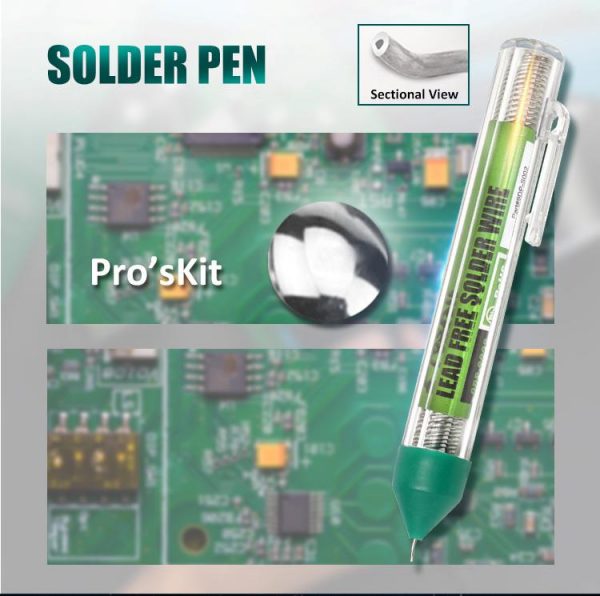
Locate an element on the screen. The image size is (600, 596). computer is located at coordinates (273, 443).